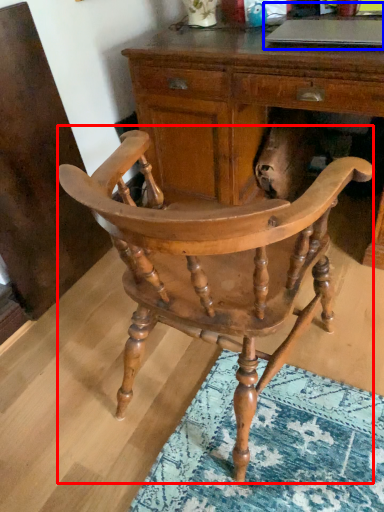
Question: Which of the following is the farthest to the observer, chair (highlighted by a red box) or computer (highlighted by a blue box)?

Choices:
 (A) chair
 (B) computer

Answer: (B)